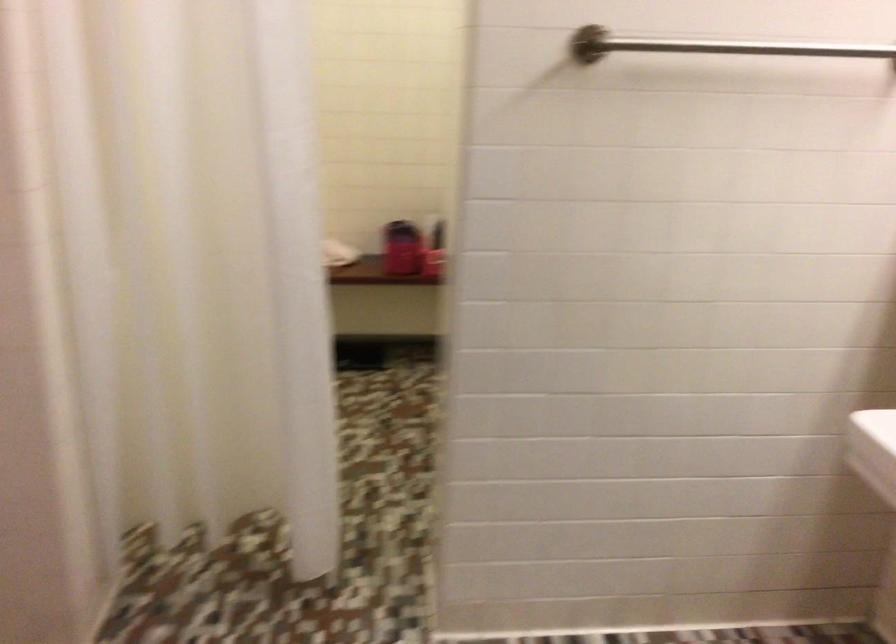
Find where to grip the metal grab bar. Please return your answer as a coordinate pair (x, y).

(711, 46)